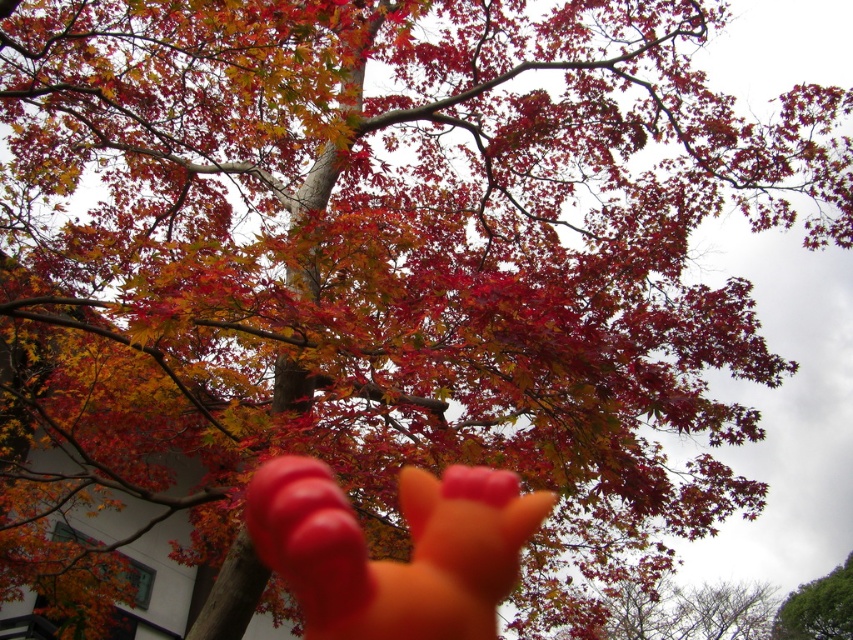
Question: Among these points, which one is farthest from the camera?

Choices:
 (A) [450, 536]
 (B) [776, 632]

Answer: (B)

Question: Is orange matte hand at lower center thinner than green leafy tree at lower right?

Choices:
 (A) no
 (B) yes

Answer: (B)

Question: Does orange matte hand at lower center come in front of green leafy tree at lower right?

Choices:
 (A) yes
 (B) no

Answer: (A)

Question: Is orange matte hand at lower center to the left of green leafy tree at lower right from the viewer's perspective?

Choices:
 (A) no
 (B) yes

Answer: (B)